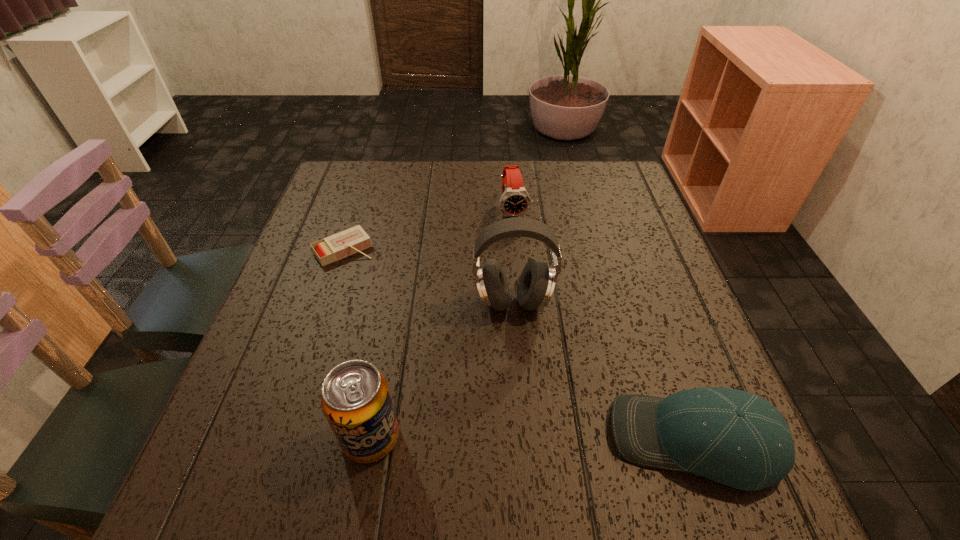
Where is `free spot located 0.060m on the ear cups of the third nearest object`? This screenshot has height=540, width=960. free spot located 0.060m on the ear cups of the third nearest object is located at coordinates (511, 346).

Where is `object present at the far edge`? object present at the far edge is located at coordinates (515, 201).

The image size is (960, 540). I want to click on soda can present at the near edge, so click(x=356, y=401).

Image resolution: width=960 pixels, height=540 pixels. I want to click on baseball cap that is at the near edge, so click(x=733, y=437).

Image resolution: width=960 pixels, height=540 pixels. Find the location of `object that is at the left edge`. object that is at the left edge is located at coordinates (330, 249).

Identify the location of object present at the right edge. (733, 437).

I want to click on object positioned at the near right corner, so click(x=733, y=437).

You are a GUI agent. You are given a task and a screenshot of the screen. Output one action in this format:
    pyautogui.click(x=<x>, y=<y>)
    Task: Click on the vacant position at the far edge of the desktop
    This screenshot has height=540, width=960.
    Given the screenshot: What is the action you would take?
    pyautogui.click(x=420, y=184)

Locate an element on the screen. This screenshot has width=960, height=540. free space at the near edge of the desktop is located at coordinates (505, 416).

The width and height of the screenshot is (960, 540). In the image, there is a desktop. In order to click on free space at the left edge in this screenshot , I will do `click(317, 302)`.